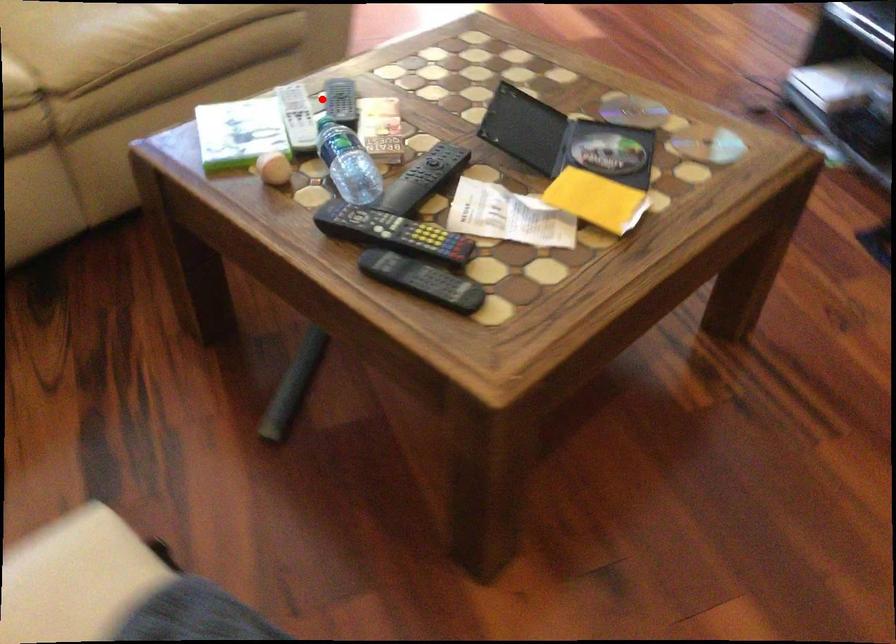
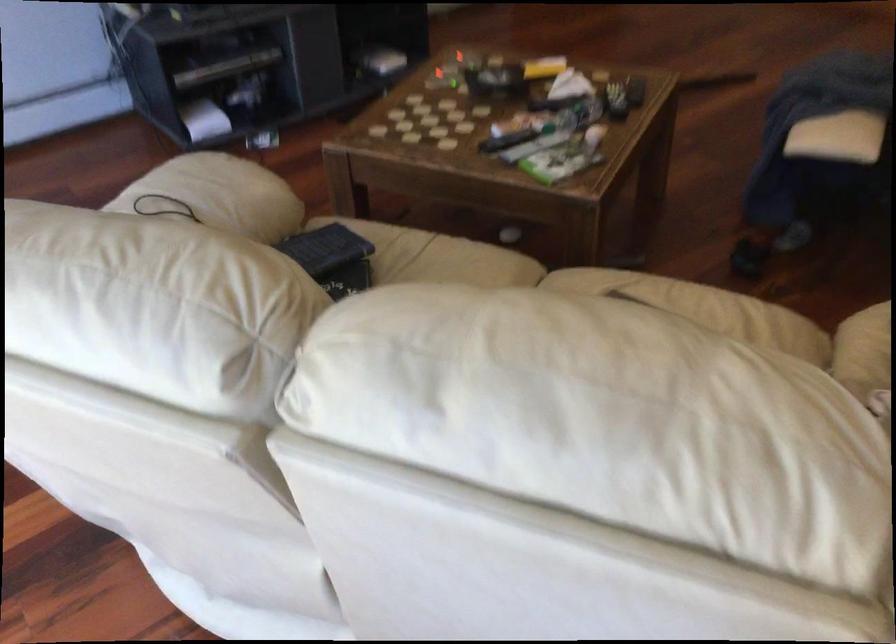
The point at the highlighted location is marked in the first image. Where is the corresponding point in the second image?

(506, 140)